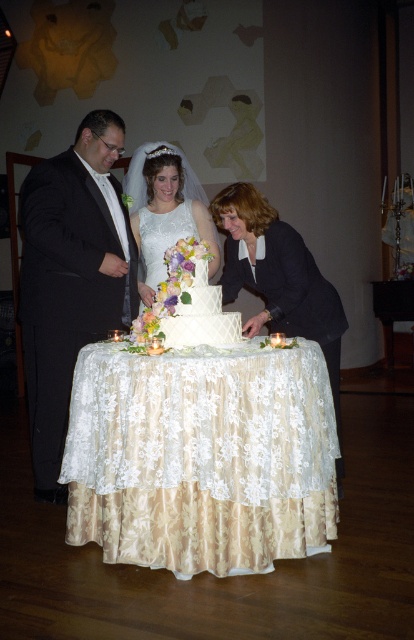
Question: Which is nearer to the white lace dress at center?

Choices:
 (A) white textured cake at center
 (B) black satin suit at left

Answer: (B)

Question: Is black satin suit at left to the left of white textured cake at center from the viewer's perspective?

Choices:
 (A) yes
 (B) no

Answer: (A)

Question: Is black satin suit at left smaller than white lace cocktail dress at center?

Choices:
 (A) yes
 (B) no

Answer: (B)

Question: Which point is farther to the camera?

Choices:
 (A) (50, 232)
 (B) (187, 292)
 (C) (144, 212)

Answer: (C)

Question: Which of the following is the closest to the observer?

Choices:
 (A) (166, 332)
 (B) (165, 202)
 (C) (158, 557)
 (D) (182, 216)

Answer: (C)

Question: Is matte black jacket at center wider than white textured cake at center?

Choices:
 (A) yes
 (B) no

Answer: (A)